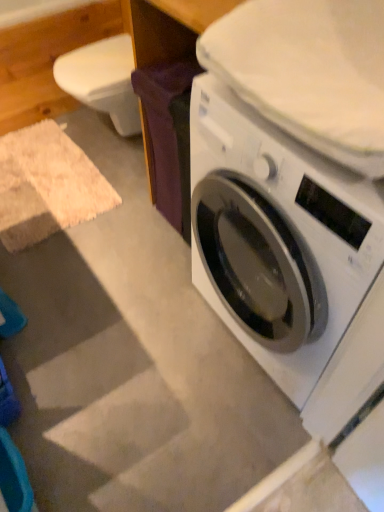
I want to click on empty space that is ontop of purple fabric at center (from a real-world perspective), so click(x=177, y=66).